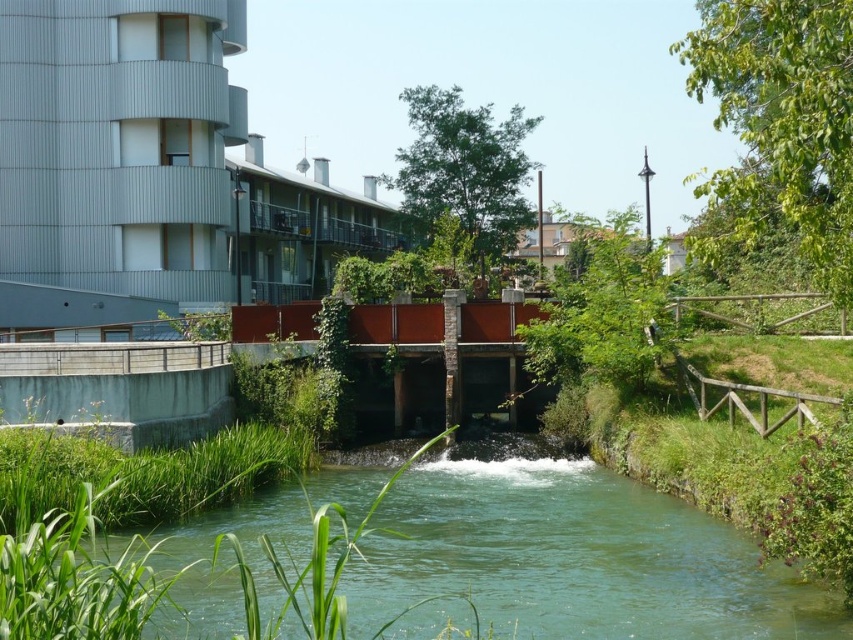
Question: In this image, where is green translucent water at center located relative to metallic gray building at upper left?

Choices:
 (A) above
 (B) below

Answer: (B)

Question: From the image, what is the correct spatial relationship of green translucent water at center in relation to metallic gray building at upper left?

Choices:
 (A) below
 (B) above

Answer: (A)

Question: Which point is farther to the camera?

Choices:
 (A) (187, 282)
 (B) (149, 468)

Answer: (A)

Question: Can you confirm if green translucent water at center is positioned above metallic gray building at upper left?

Choices:
 (A) yes
 (B) no

Answer: (B)